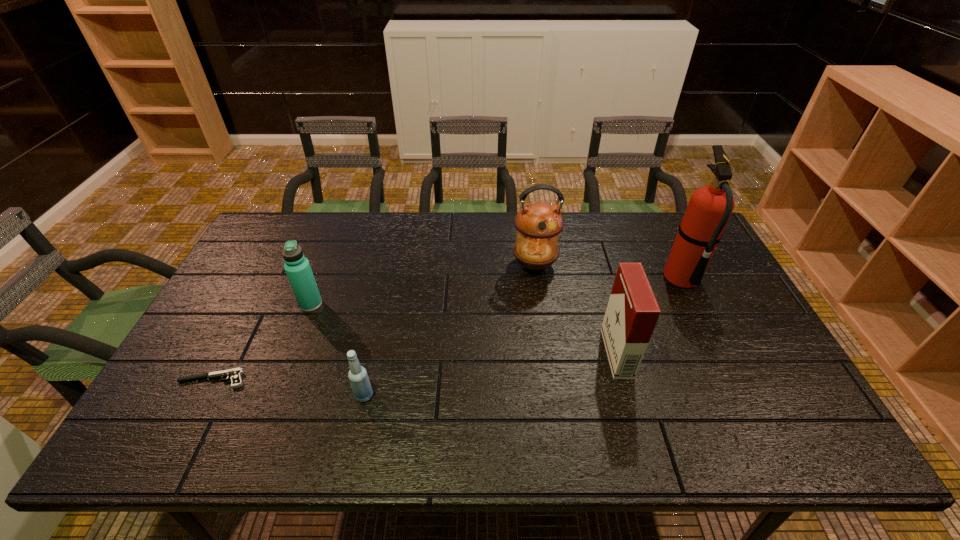
Identify the location of free space located at the nozzle of the tallest object. Image resolution: width=960 pixels, height=540 pixels. tap(609, 279).

You are a GUI agent. You are given a task and a screenshot of the screen. Output one action in this format:
    pyautogui.click(x=<x>, y=<y>)
    Task: Click on the free space located 0.240m at the nozzle of the tallest object
    
    Given the screenshot: What is the action you would take?
    pyautogui.click(x=587, y=279)

This screenshot has height=540, width=960. Identify the location of vacant space located 0.230m at the nozzle of the tallest object. (590, 279).

In order to click on vacant position located 0.360m on the right of the third object from right to left in this screenshot , I will do `click(668, 265)`.

The image size is (960, 540). What are the coordinates of `vacant space positioned on the front-facing side of the cigarette_case` in the screenshot? It's located at (475, 353).

Locate an element on the screen. vacant region located on the front-facing side of the cigarette_case is located at coordinates (460, 353).

At what (x,y) coordinates should I click in order to perform the action: click on blank area located on the front-facing side of the cigarette_case. Please return your answer as a coordinate pair (x, y). Image resolution: width=960 pixels, height=540 pixels. Looking at the image, I should click on (588, 353).

Locate an element on the screen. The height and width of the screenshot is (540, 960). vacant position located on the right of the thermos bottle is located at coordinates (423, 304).

Where is `vacant region located on the right of the fifth tallest object`? vacant region located on the right of the fifth tallest object is located at coordinates (455, 395).

Identify the location of object that is at the far edge. (538, 224).